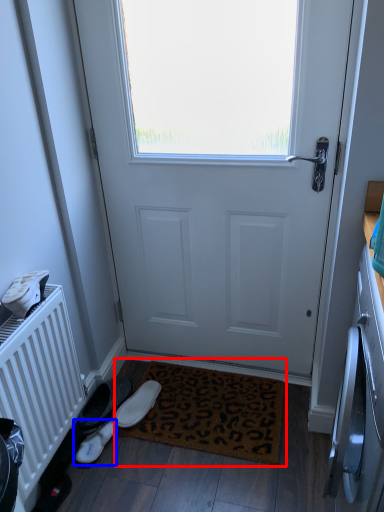
Question: Which object appears farthest to the camera in this image, doormat (highlighted by a red box) or footwear (highlighted by a blue box)?

Choices:
 (A) doormat
 (B) footwear

Answer: (B)